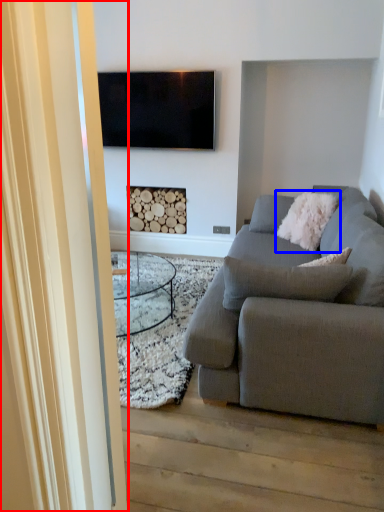
Question: Which object appears farthest to the camera in this image, glass door (highlighted by a red box) or pillow (highlighted by a blue box)?

Choices:
 (A) glass door
 (B) pillow

Answer: (B)